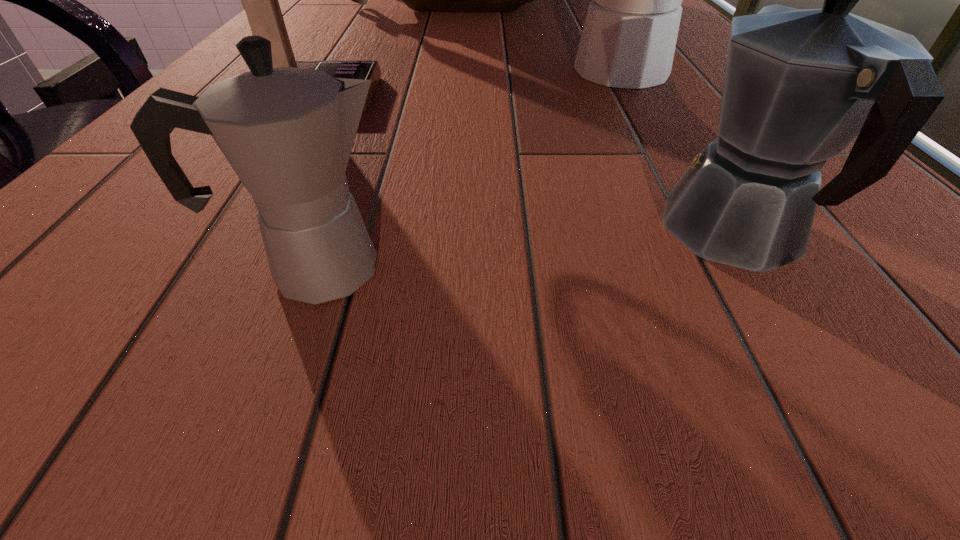
The width and height of the screenshot is (960, 540). In order to click on free region at the left edge of the desktop in this screenshot , I will do `click(333, 14)`.

Where is `free space between the fan and the third shortest object`? This screenshot has width=960, height=540. free space between the fan and the third shortest object is located at coordinates (477, 83).

Where is `vacant area that lies between the fan and the farthest coffeepot`? vacant area that lies between the fan and the farthest coffeepot is located at coordinates (477, 83).

Locate an element on the screen. free space between the leftmost coffeepot and the farthest coffeepot is located at coordinates (477, 170).

Locate an element on the screen. the third closest object relative to the farthest object is located at coordinates (800, 85).

Point out which object is positioned as the fourth nearest to the farthest coffeepot. Please provide its 2D coordinates. Your answer should be formatted as a tuple, i.e. [(x, y)], where the tuple contains the x and y coordinates of a point satisfying the conditions above.

[(287, 132)]

Identify which coffeepot is the second closest to the tallest coffeepot. Please provide its 2D coordinates. Your answer should be formatted as a tuple, i.e. [(x, y)], where the tuple contains the x and y coordinates of a point satisfying the conditions above.

[(287, 132)]

Locate which coffeepot ranks in proximity to the fan. Please provide its 2D coordinates. Your answer should be formatted as a tuple, i.e. [(x, y)], where the tuple contains the x and y coordinates of a point satisfying the conditions above.

[(287, 132)]